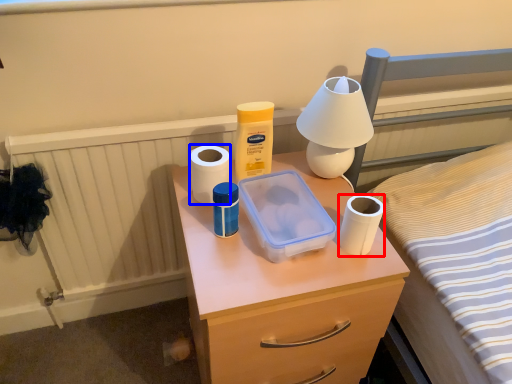
Question: Among these objects, which one is nearest to the camera, toilet paper (highlighted by a red box) or toilet paper (highlighted by a blue box)?

Choices:
 (A) toilet paper
 (B) toilet paper

Answer: (A)